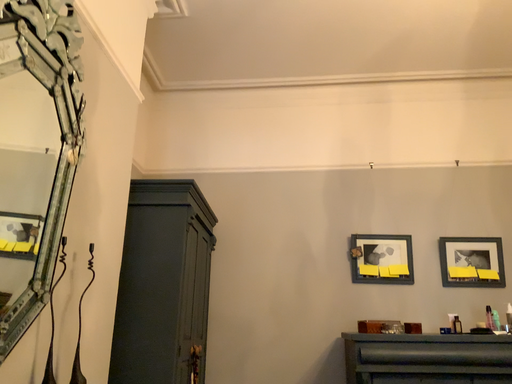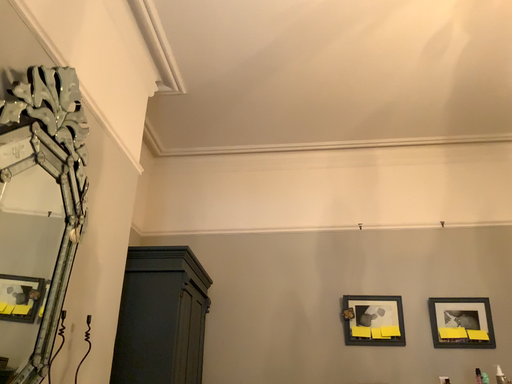
Question: Which way did the camera rotate in the video?

Choices:
 (A) rotated downward
 (B) rotated upward

Answer: (B)